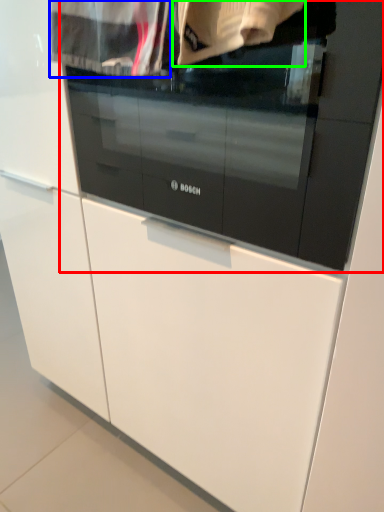
Question: Estimate the real-world distances between objects in this image. Which object is closer to oven (highlighted by a red box), clothing (highlighted by a blue box) or clothing (highlighted by a green box)?

Choices:
 (A) clothing
 (B) clothing

Answer: (B)